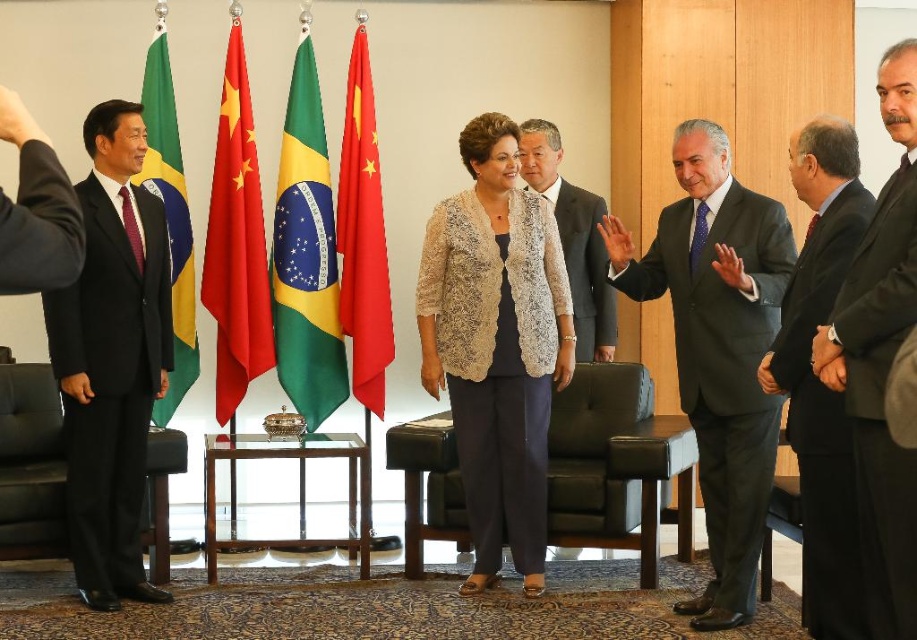
You are attending the diplomatic meeting and need to locate the dark gray suit at right. According to the scene, where is it in relation to the red fabric flag at center?

The dark gray suit at right is positioned under the red fabric flag at center.

You are a photographer at the diplomatic meeting and need to capture a photo of the dark gray suit at center and the green fabric flag at left. Based on their positions, which object is located to the left of the other?

The dark gray suit at center is positioned on the right side of green fabric flag at left, so the green fabric flag at left is to the left of the dark gray suit at center.